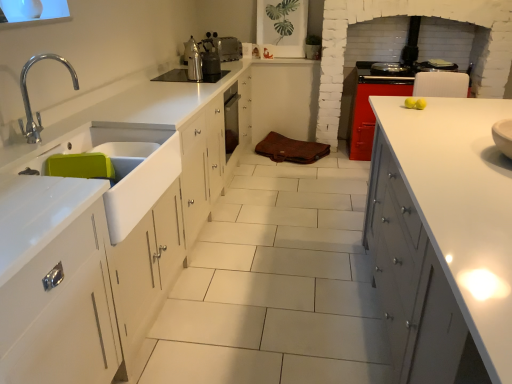
Where is `metallic silver kettle at center, the 1th appliance viewed from the front`? This screenshot has height=384, width=512. metallic silver kettle at center, the 1th appliance viewed from the front is located at coordinates (210, 59).

Measure the distance between point (239,82) and camera.

Point (239,82) is 3.96 meters away from camera.

What is the approximate height of black glass cooktop at upper center?

black glass cooktop at upper center is 0.85 inches tall.

This screenshot has width=512, height=384. What do you see at coordinates (228, 48) in the screenshot?
I see `silver metallic toaster at center, marked as the 2th appliance in a bottom-to-top arrangement` at bounding box center [228, 48].

You are a GUI agent. You are given a task and a screenshot of the screen. Output one action in this format:
    pyautogui.click(x=<x>, y=<y>)
    Task: Click on the metallic silver kettle at center, the 1th appliance viewed from the front
    
    Given the screenshot: What is the action you would take?
    pyautogui.click(x=210, y=59)

Which point is more distant from viewer, (290, 124) or (56, 55)?

The point (290, 124) is more distant.

Measure the distance from brown leather bag at center, arranged as the second cabinetry when viewed from the front, to polished chrome tap at left.

brown leather bag at center, arranged as the second cabinetry when viewed from the front, and polished chrome tap at left are 8.28 feet apart from each other.

Choose the correct answer: Is brown leather bag at center, the second cabinetry positioned from the bottom, inside polished chrome tap at left or outside it?

brown leather bag at center, the second cabinetry positioned from the bottom, lies outside polished chrome tap at left.

Is metallic silver kettle at center, marked as the 2th appliance in a top-to-bottom arrangement, turned away from silver metallic toaster at center, marked as the 2th appliance in a bottom-to-top arrangement?

That's not correct — metallic silver kettle at center, marked as the 2th appliance in a top-to-bottom arrangement, is not looking away from silver metallic toaster at center, marked as the 2th appliance in a bottom-to-top arrangement.

Is metallic silver kettle at center, the 1th appliance viewed from the front, wider or thinner than silver metallic toaster at center, placed as the 2th appliance when sorted from front to back?

Considering their sizes, metallic silver kettle at center, the 1th appliance viewed from the front, looks slimmer than silver metallic toaster at center, placed as the 2th appliance when sorted from front to back.

Does metallic silver kettle at center, the 1th appliance viewed from the front, lie behind silver metallic toaster at center, acting as the 1th appliance starting from the top?

No, metallic silver kettle at center, the 1th appliance viewed from the front, is in front of silver metallic toaster at center, acting as the 1th appliance starting from the top.

Is metallic silver kettle at center, which is the 2th appliance in back-to-front order, directly adjacent to silver metallic toaster at center, placed as the 2th appliance when sorted from front to back?

There is a gap between metallic silver kettle at center, which is the 2th appliance in back-to-front order, and silver metallic toaster at center, placed as the 2th appliance when sorted from front to back.

Would you say white glossy cabinet at right, marked as the 1th cabinetry in a front-to-back arrangement, is inside or outside metallic silver kettle at center, which is the 2th appliance in back-to-front order?

white glossy cabinet at right, marked as the 1th cabinetry in a front-to-back arrangement, is spatially situated outside metallic silver kettle at center, which is the 2th appliance in back-to-front order.

I want to click on the 2nd appliance to the left of the white glossy cabinet at right, which appears as the 2th cabinetry when viewed from the back, starting your count from the anchor, so click(x=210, y=59).

Does white glossy cabinet at right, which appears as the 2th cabinetry when viewed from the back, have a larger size compared to metallic silver kettle at center, the 1th appliance viewed from the front?

Indeed, white glossy cabinet at right, which appears as the 2th cabinetry when viewed from the back, has a larger size compared to metallic silver kettle at center, the 1th appliance viewed from the front.

Which is less distant, [476,186] or [203,40]?

Point [476,186].

Can you confirm if black glass cooktop at upper center is thinner than shiny metallic stove at upper right?

Incorrect, the width of black glass cooktop at upper center is not less than that of shiny metallic stove at upper right.

Find the location of `home appliance in front of the shiny metallic stove at upper right`. home appliance in front of the shiny metallic stove at upper right is located at coordinates (187, 76).

Can you see black glass cooktop at upper center touching shiny metallic stove at upper right?

No, black glass cooktop at upper center is not touching shiny metallic stove at upper right.

Considering the positions of objects white glossy cabinet at right, which appears as the 2th cabinetry when viewed from the back, and silver metallic toaster at center, the 1th appliance in the back-to-front sequence, in the image provided, who is more to the left, white glossy cabinet at right, which appears as the 2th cabinetry when viewed from the back, or silver metallic toaster at center, the 1th appliance in the back-to-front sequence,?

silver metallic toaster at center, the 1th appliance in the back-to-front sequence, is more to the left.

Is white glossy cabinet at right, marked as the second cabinetry in a top-to-bottom arrangement, not within silver metallic toaster at center, marked as the 2th appliance in a bottom-to-top arrangement?

Yes, white glossy cabinet at right, marked as the second cabinetry in a top-to-bottom arrangement, is outside of silver metallic toaster at center, marked as the 2th appliance in a bottom-to-top arrangement.

Is point (493, 331) closer or farther from the camera than point (216, 34)?

Point (493, 331) is positioned closer to the camera compared to point (216, 34).

Could you tell me if white glossy cabinet at right, which appears as the 2th cabinetry when viewed from the back, is facing silver metallic toaster at center, acting as the 1th appliance starting from the top?

No, white glossy cabinet at right, which appears as the 2th cabinetry when viewed from the back, is not facing towards silver metallic toaster at center, acting as the 1th appliance starting from the top.

From the image's perspective, which one is positioned lower, polished chrome tap at left or white glossy sink at left?

white glossy sink at left, from the image's perspective.

How far apart are polished chrome tap at left and white glossy sink at left?

polished chrome tap at left and white glossy sink at left are 14.82 inches apart.

Can you confirm if polished chrome tap at left is thinner than white glossy sink at left?

Yes.

Would you say polished chrome tap at left contains white glossy sink at left?

No, white glossy sink at left is not a part of polished chrome tap at left.

Which is in front, point (289, 135) or point (391, 63)?

The point (391, 63) is closer.

In order to click on kitchen appliance lying above the brown leather bag at center, the second cabinetry positioned from the bottom (from the image's perspective) in this screenshot , I will do `click(389, 69)`.

Is brown leather bag at center, the second cabinetry positioned from the bottom, wider than shiny metallic stove at upper right?

Yes.

Based on the photo, is brown leather bag at center, arranged as the second cabinetry when viewed from the front, positioned in front of shiny metallic stove at upper right?

That is False.

Identify the location of tap on the left of brown leather bag at center, which is the first cabinetry from top to bottom. This screenshot has height=384, width=512. (28, 96).

Find the location of a particular element. This screenshot has height=384, width=512. appliance positioned vertically above the silver metallic toaster at center, the 1th appliance in the back-to-front sequence (from a real-world perspective) is located at coordinates (210, 59).

From the image, which object appears to be farther from black glass cooktop at upper center, white glossy cabinet at right, marked as the second cabinetry in a top-to-bottom arrangement, or polished chrome tap at left?

white glossy cabinet at right, marked as the second cabinetry in a top-to-bottom arrangement, is positioned further to the anchor black glass cooktop at upper center.

Looking at the image, which one is located further to shiny metallic stove at upper right, silver metallic toaster at center, acting as the 1th appliance starting from the top, or white glossy cabinet at right, marked as the 1th cabinetry in a front-to-back arrangement?

Among the two, white glossy cabinet at right, marked as the 1th cabinetry in a front-to-back arrangement, is located further to shiny metallic stove at upper right.

Which object lies further to the anchor point metallic silver kettle at center, the 1th appliance viewed from the front, black glass cooktop at upper center or brown leather bag at center, the 1th cabinetry viewed from the back?

Based on the image, brown leather bag at center, the 1th cabinetry viewed from the back, appears to be further to metallic silver kettle at center, the 1th appliance viewed from the front.

Based on their spatial positions, is brown leather bag at center, the 1th cabinetry viewed from the back, or metallic silver kettle at center, the first appliance in the bottom-to-top sequence, closer to polished chrome tap at left?

metallic silver kettle at center, the first appliance in the bottom-to-top sequence, lies closer to polished chrome tap at left than the other object.

From the image, which object appears to be nearer to black glass cooktop at upper center, metallic silver kettle at center, the first appliance in the bottom-to-top sequence, or silver metallic toaster at center, marked as the 2th appliance in a bottom-to-top arrangement?

metallic silver kettle at center, the first appliance in the bottom-to-top sequence, is closer to black glass cooktop at upper center.

Estimate the real-world distances between objects in this image. Which object is further from polished chrome tap at left, brown leather bag at center, the second cabinetry positioned from the bottom, or white glossy sink at left?

brown leather bag at center, the second cabinetry positioned from the bottom, is positioned further to the anchor polished chrome tap at left.

Estimate the real-world distances between objects in this image. Which object is closer to white glossy cabinet at right, marked as the second cabinetry in a top-to-bottom arrangement, black glass cooktop at upper center or shiny metallic stove at upper right?

Based on the image, shiny metallic stove at upper right appears to be nearer to white glossy cabinet at right, marked as the second cabinetry in a top-to-bottom arrangement.

When comparing their distances from shiny metallic stove at upper right, does metallic silver kettle at center, the first appliance in the bottom-to-top sequence, or white glossy cabinet at right, which appears as the 2th cabinetry when viewed from the back, seem closer?

Based on the image, metallic silver kettle at center, the first appliance in the bottom-to-top sequence, appears to be nearer to shiny metallic stove at upper right.

Locate an element on the screen. home appliance between white glossy cabinet at right, marked as the 1th cabinetry in a front-to-back arrangement, and brown leather bag at center, the second cabinetry positioned from the bottom, along the z-axis is located at coordinates (187, 76).

Locate an element on the screen. appliance located between white glossy sink at left and shiny metallic stove at upper right in the depth direction is located at coordinates (210, 59).

Locate an element on the screen. appliance between black glass cooktop at upper center and silver metallic toaster at center, marked as the 2th appliance in a bottom-to-top arrangement, from front to back is located at coordinates (210, 59).

This screenshot has height=384, width=512. Identify the location of home appliance positioned between white glossy sink at left and silver metallic toaster at center, acting as the 1th appliance starting from the top, from near to far. (187, 76).